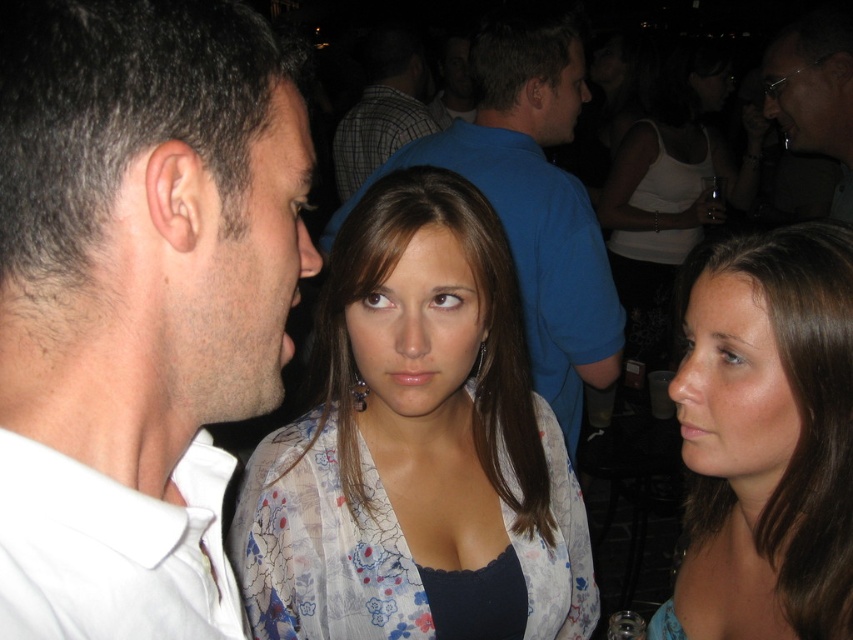
You are a photographer at the event and need to adjust the lighting to focus on the white matte shirt at center. Based on its position, which direction should you move the spotlight to ensure it hits the shirt directly?

The white matte shirt at center is positioned at coordinates point 0.477 on the x and 0.162 on the y axis. To center the spotlight on it, move the spotlight towards the lower right direction since the shirt is located slightly to the right and lower part of the frame.

You are at a party and want to borrow the sunglasses at upper right from the person wearing the plaid shirt at center. Which direction should you approach them from?

The sunglasses at upper right is positioned on the right side of plaid shirt at center, so you should approach from the right side to borrow them.

You are standing at the point marked as point (804, 152) in the image. If you want to take a photo of the group of people in the background, will you need to zoom in or zoom out?

The distance of point (804, 152) from camera is 8.06 feet, so you will need to zoom out to capture the entire group of people in the background.